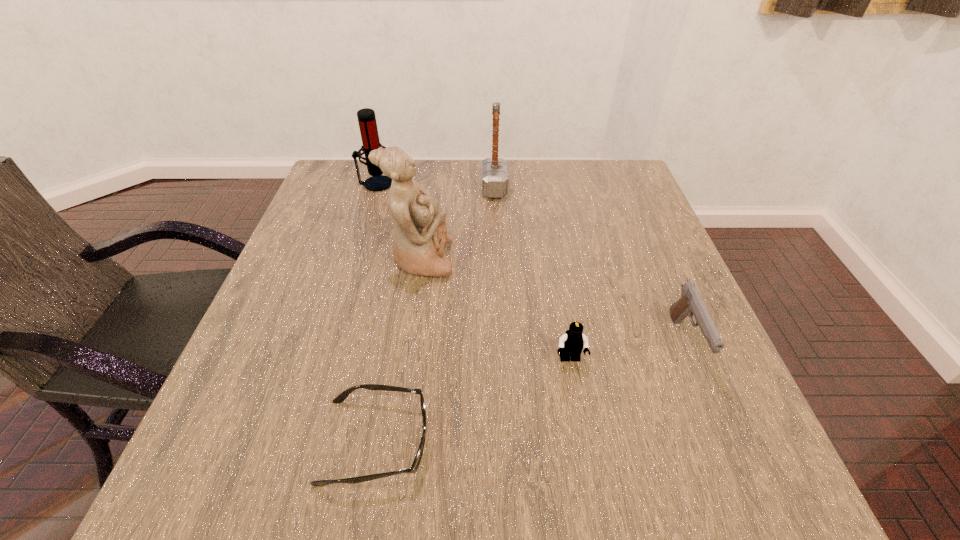
Find the location of `vacant area that lies between the shortest object and the figurine`. vacant area that lies between the shortest object and the figurine is located at coordinates (398, 350).

Locate an element on the screen. unoccupied area between the microphone and the fourth object from left to right is located at coordinates (435, 186).

What are the coordinates of `vacant space that's between the microphone and the hammer` in the screenshot? It's located at pos(435,186).

Find the location of `vacant space in between the nearest object and the Lego`. vacant space in between the nearest object and the Lego is located at coordinates (472, 400).

In order to click on free spot between the microphone and the rightmost object in this screenshot , I will do `click(530, 263)`.

Identify which object is the fourth nearest to the second object from right to left. Please provide its 2D coordinates. Your answer should be formatted as a tuple, i.e. [(x, y)], where the tuple contains the x and y coordinates of a point satisfying the conditions above.

[(494, 170)]

Locate which object ranks second in proximity to the nearest object. Please provide its 2D coordinates. Your answer should be formatted as a tuple, i.e. [(x, y)], where the tuple contains the x and y coordinates of a point satisfying the conditions above.

[(420, 234)]

Where is `vacant region that satisfies the following two spatial constraints: 1. on the front-facing side of the Lego; 2. on the front-facing side of the nearest object`? The height and width of the screenshot is (540, 960). vacant region that satisfies the following two spatial constraints: 1. on the front-facing side of the Lego; 2. on the front-facing side of the nearest object is located at coordinates (585, 441).